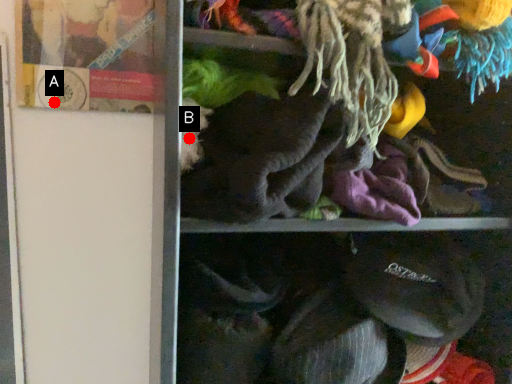
Question: Two points are circled on the image, labeled by A and B beside each circle. Which point is further to the camera?

Choices:
 (A) A is further
 (B) B is further

Answer: (A)